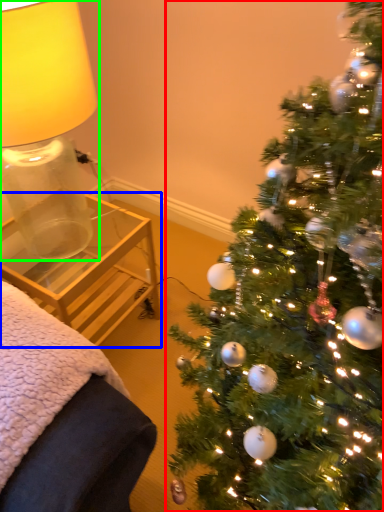
Question: Which is nearer to the christmas tree (highlighted by a red box)? table (highlighted by a blue box) or table lamp (highlighted by a green box).

Choices:
 (A) table
 (B) table lamp

Answer: (A)